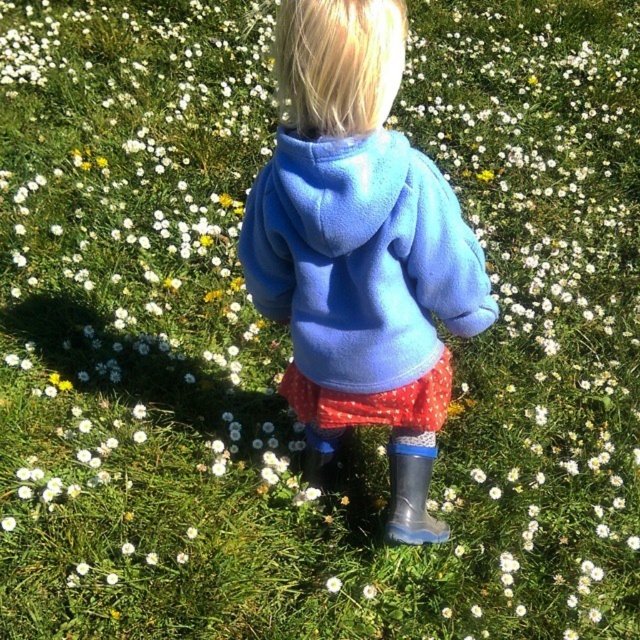
You are a gardener who wants to plant a new flower in the field. You notice the transparent rubber boot at lower right and the white fluffy flower at center. Which object is taller and would require more space vertically?

The transparent rubber boot at lower right is much taller than the white fluffy flower at center, so it would require more vertical space.

You are a fashion designer observing the child in the field. You need to determine which item of clothing is larger in size between the matte blue sweatshirt at center and the transparent rubber boot at lower right. Which one is bigger?

The matte blue sweatshirt at center is bigger than the transparent rubber boot at lower right according to the description provided.

You are a photographer trying to capture a closeup of the matte blue sweatshirt at center and the transparent rubber boot at lower right in the image. The camera can only focus on objects within a 45 cm range. Will both objects be in focus?

The matte blue sweatshirt at center and transparent rubber boot at lower right are 45.51 centimeters apart from each other. Since the camera can only focus within a 45 cm range, the distance between them exceeds this limit, so both objects cannot be in focus simultaneously.